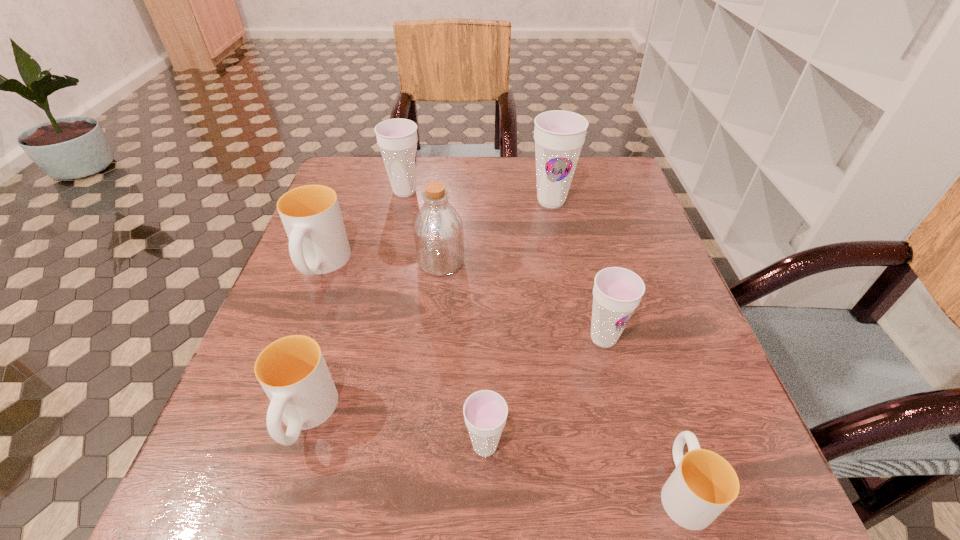
Point out which cup is positioned as the second nearest to the fourth cup from left to right. Please provide its 2D coordinates. Your answer should be formatted as a tuple, i.e. [(x, y)], where the tuple contains the x and y coordinates of a point satisfying the conditions above.

[(292, 371)]

Locate which cup is the sixth closest to the second smallest yellow cup. Please provide its 2D coordinates. Your answer should be formatted as a tuple, i.e. [(x, y)], where the tuple contains the x and y coordinates of a point satisfying the conditions above.

[(559, 135)]

Identify the location of purple cup that can be found as the closest to the leftmost purple cup. Image resolution: width=960 pixels, height=540 pixels. (559, 135).

Select which purple cup is the fourth closest to the bottle. Please provide its 2D coordinates. Your answer should be formatted as a tuple, i.e. [(x, y)], where the tuple contains the x and y coordinates of a point satisfying the conditions above.

[(485, 412)]

Select which yellow cup appears as the third closest to the second tallest cup. Please provide its 2D coordinates. Your answer should be formatted as a tuple, i.e. [(x, y)], where the tuple contains the x and y coordinates of a point satisfying the conditions above.

[(703, 484)]

Select which yellow cup appears as the third closest to the fifth object from right to left. Please provide its 2D coordinates. Your answer should be formatted as a tuple, i.e. [(x, y)], where the tuple contains the x and y coordinates of a point satisfying the conditions above.

[(703, 484)]

The image size is (960, 540). Find the location of `free spot that satisfies the following two spatial constraints: 1. with the handle on the side of the second biggest yellow cup; 2. on the left side of the nearest purple cup`. free spot that satisfies the following two spatial constraints: 1. with the handle on the side of the second biggest yellow cup; 2. on the left side of the nearest purple cup is located at coordinates (296, 446).